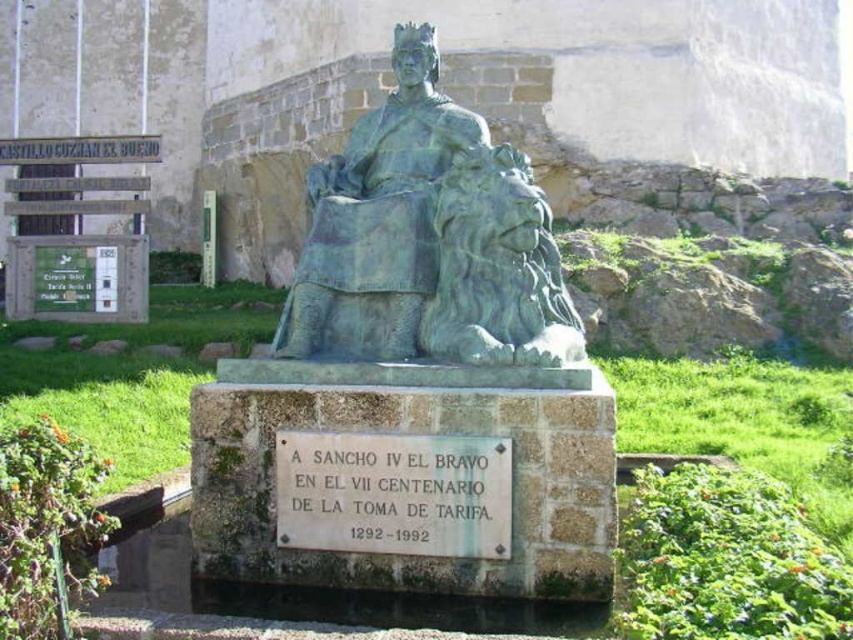
Does green patina statue at center have a smaller size compared to white stone plaque at center?

Correct, green patina statue at center occupies less space than white stone plaque at center.

Who is shorter, green patina statue at center or white stone plaque at center?

green patina statue at center is shorter.

Does point (378, 284) lie behind point (498, 476)?

Yes, it is.

Find the location of a particular element. green patina statue at center is located at coordinates [x=427, y=240].